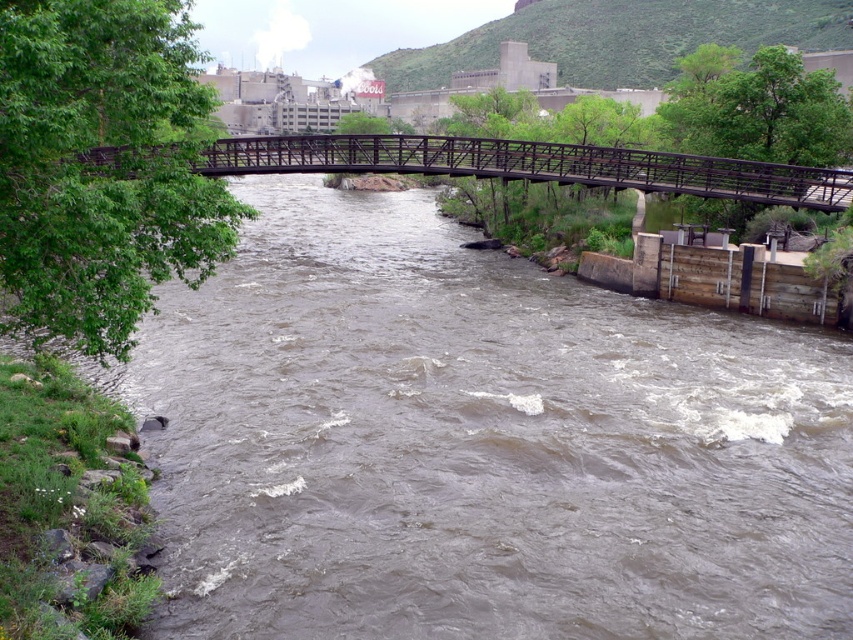
You are a hiker trying to cross the river using the metallic bridge at center. You notice the brown muddy water at center flowing strongly. Considering the bridge is to the right of the water, which direction should you face to cross safely towards the green area on the left?

The brown muddy water at center is to the left of the metallic bridge at center, so to cross safely towards the green area on the left, you should face towards the metallic bridge at center and walk towards its right side, as the bridge is positioned to the right of the water. This way, you can avoid the strong currents of the brown muddy water at center.

Based on the photo, you are standing at the metal pedestrian bridge and want to determine the relative positions of two points in the scene. Specifically, you need to know which of the two points, point 1 at coordinates point (312, 182) or point 2 at coordinates point (274, 138), is closer to you. Can you identify which point is nearer based on the scene description?

Point 1 at coordinates point (312, 182) is closer to you than point 2 at coordinates point (274, 138) because it is further to the viewer according to the description.